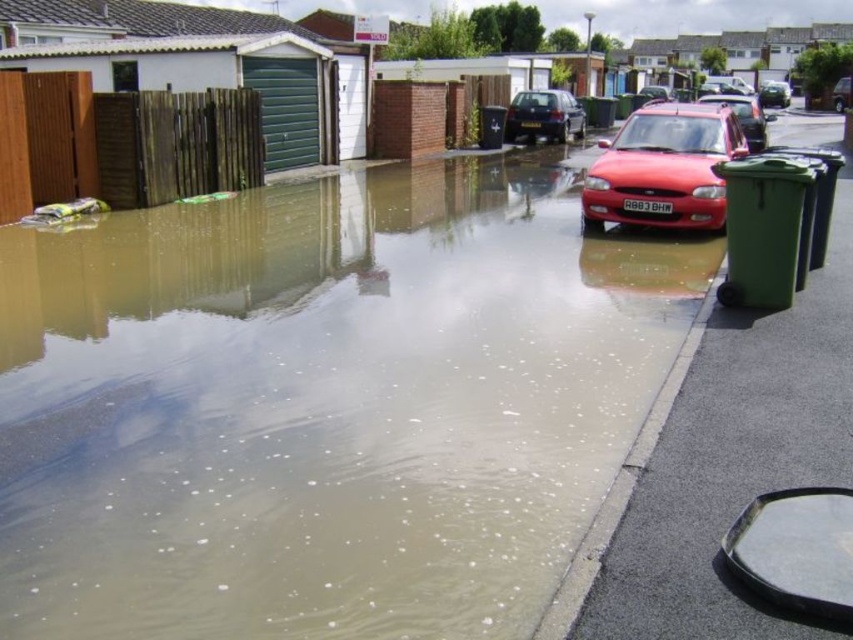
Question: Which of the following is the farthest from the observer?

Choices:
 (A) (775, 92)
 (B) (740, 122)

Answer: (A)

Question: Considering the relative positions of matte red car at center and matte black car at center in the image provided, where is matte red car at center located with respect to matte black car at center?

Choices:
 (A) left
 (B) right

Answer: (B)

Question: Can you confirm if matte black car at center is bigger than metallic silver car at upper right?

Choices:
 (A) yes
 (B) no

Answer: (B)

Question: Estimate the real-world distances between objects in this image. Which object is closer to the matte black car at center?

Choices:
 (A) metallic red car at center
 (B) metallic silver car at upper right

Answer: (A)

Question: Is metallic red car at center wider than metallic silver car at upper right?

Choices:
 (A) no
 (B) yes

Answer: (A)

Question: Based on their relative distances, which object is farther from the metallic red car at center?

Choices:
 (A) matte red car at center
 (B) brown/muddy water at lower left

Answer: (B)